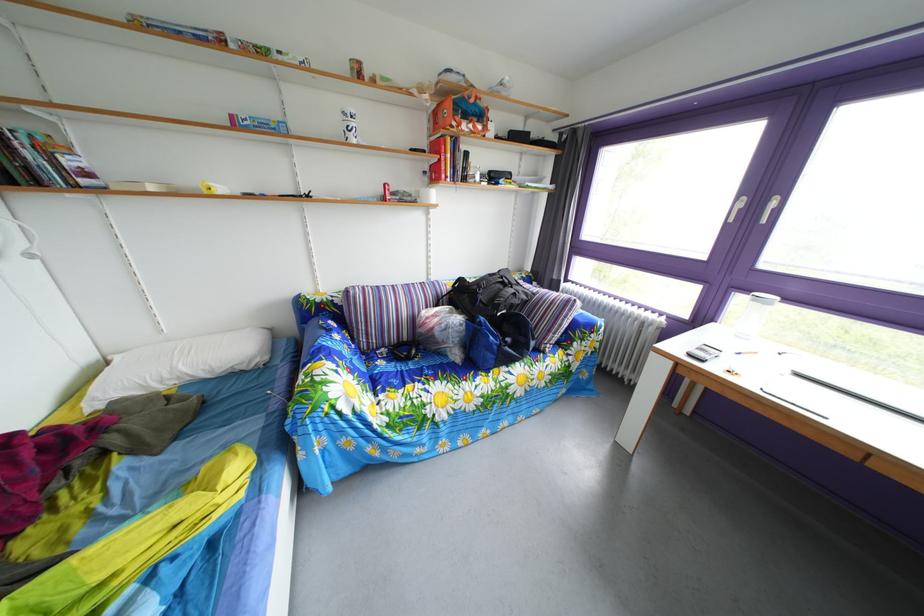
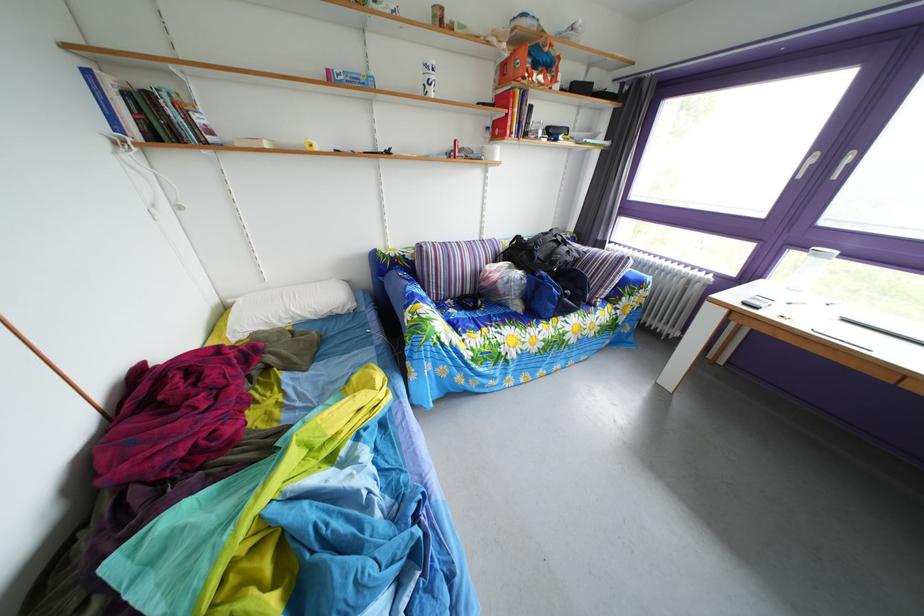
In the second image, find the point that corresponds to point 184,379 in the first image.

(298, 320)